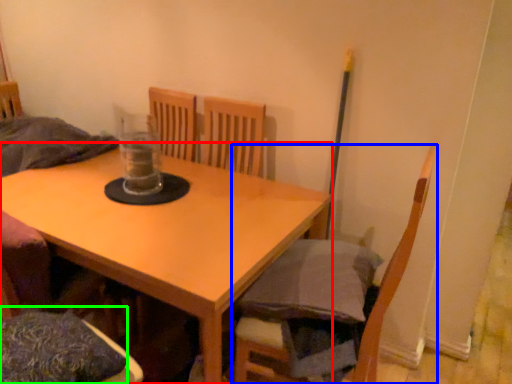
Question: Considering the real-world distances, which object is closest to table (highlighted by a red box)? chair (highlighted by a blue box) or pillow (highlighted by a green box).

Choices:
 (A) chair
 (B) pillow

Answer: (B)